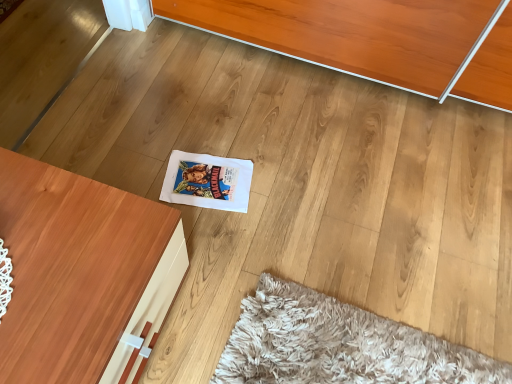
The height and width of the screenshot is (384, 512). What do you see at coordinates (207, 181) in the screenshot? I see `white paper comic book at center` at bounding box center [207, 181].

Identify the location of white paper comic book at center. (207, 181).

I want to click on white paper comic book at center, so click(x=207, y=181).